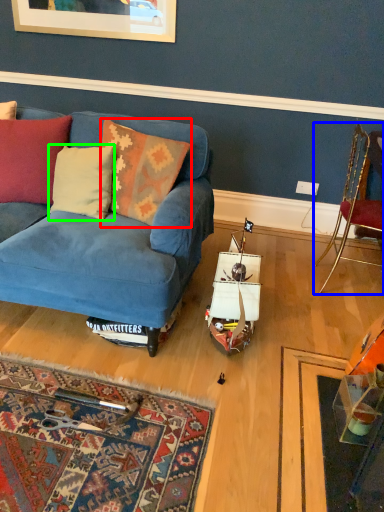
Question: Which object is the farthest from pillow (highlighted by a red box)? Choose among these: chair (highlighted by a blue box) or pillow (highlighted by a green box).

Choices:
 (A) chair
 (B) pillow

Answer: (A)